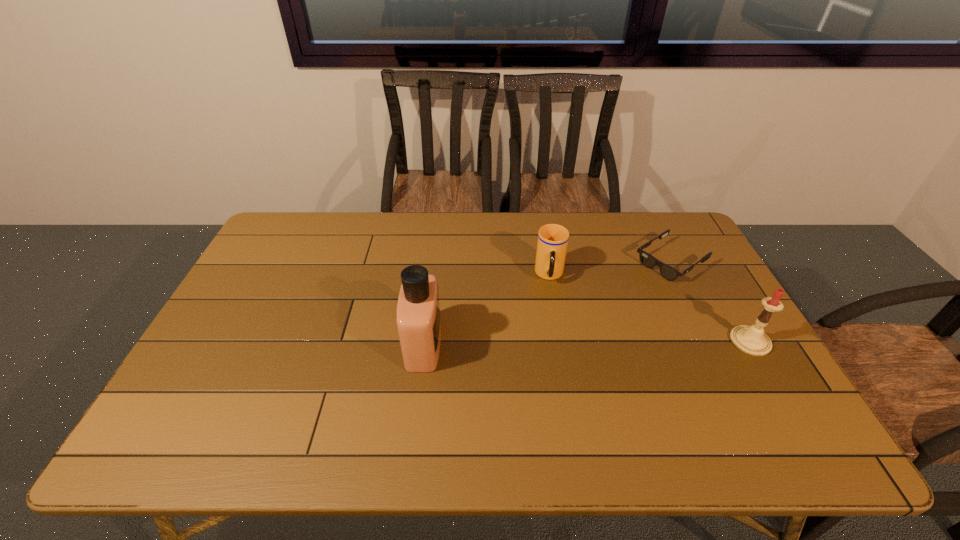
Locate an element on the screen. Image resolution: width=960 pixels, height=540 pixels. vacant space that is in between the second object from left to right and the leftmost object is located at coordinates (487, 310).

This screenshot has width=960, height=540. I want to click on vacant point located between the shortest object and the tallest object, so click(547, 303).

Identify the location of vacant region between the candle and the sunglasses. (710, 301).

At what (x,y) coordinates should I click in order to perform the action: click on object that is the closest to the second object from left to right. Please return your answer as a coordinate pair (x, y). Looking at the image, I should click on (669, 273).

You are a GUI agent. You are given a task and a screenshot of the screen. Output one action in this format:
    pyautogui.click(x=<x>, y=<y>)
    Task: Click on the object that stands as the third closest to the sunglasses
    This screenshot has width=960, height=540.
    Given the screenshot: What is the action you would take?
    pyautogui.click(x=418, y=310)